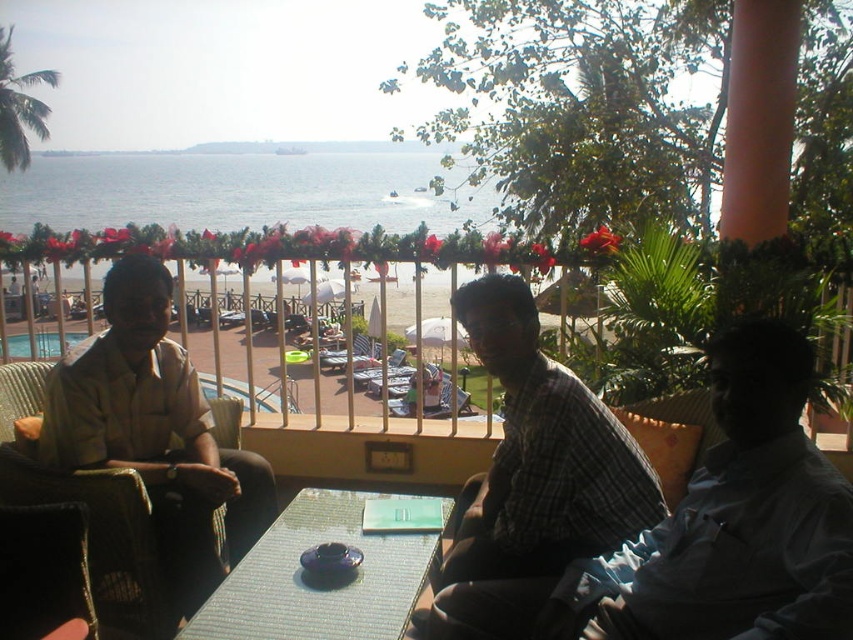
You are a photographer trying to capture a group photo of the plaid fabric shirt at center and the matte beige shirt at left. Since you want to ensure both subjects are in focus, you need to know which one is shorter. Can you determine which of the two is shorter?

The plaid fabric shirt at center has a lesser height compared to matte beige shirt at left, so the plaid fabric shirt at center is shorter.

You are planning to place a rectangular book on the table. The book is as wide as the matte beige shirt at left. Will the book fit on the translucent glass table at center?

The matte beige shirt at left might be wider than translucent glass table at center, so the book might not fit on the table.

You are a photographer trying to capture the scene of the matte beige shirt at left and the translucent glass table at center. If you want to ensure both are in focus, which object should you adjust your camera focus to prioritize?

Since the matte beige shirt at left is bigger than the translucent glass table at center, you should prioritize focusing on the matte beige shirt at left to ensure it is sharp and in focus.